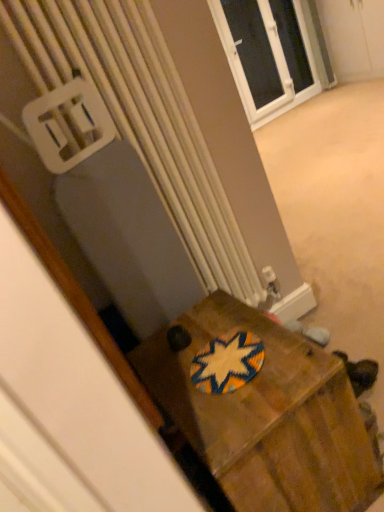
You are a GUI agent. You are given a task and a screenshot of the screen. Output one action in this format:
    pyautogui.click(x=<x>, y=<y>)
    Task: Click on the blank space to the left of woven fabric coaster at center
    
    Given the screenshot: What is the action you would take?
    pyautogui.click(x=167, y=378)